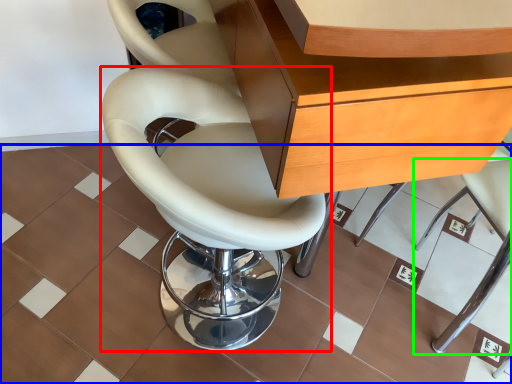
Question: Estimate the real-world distances between objects in this image. Which object is farther from chair (highlighted by a red box), ceramic tile (highlighted by a blue box) or chair (highlighted by a green box)?

Choices:
 (A) ceramic tile
 (B) chair

Answer: (B)